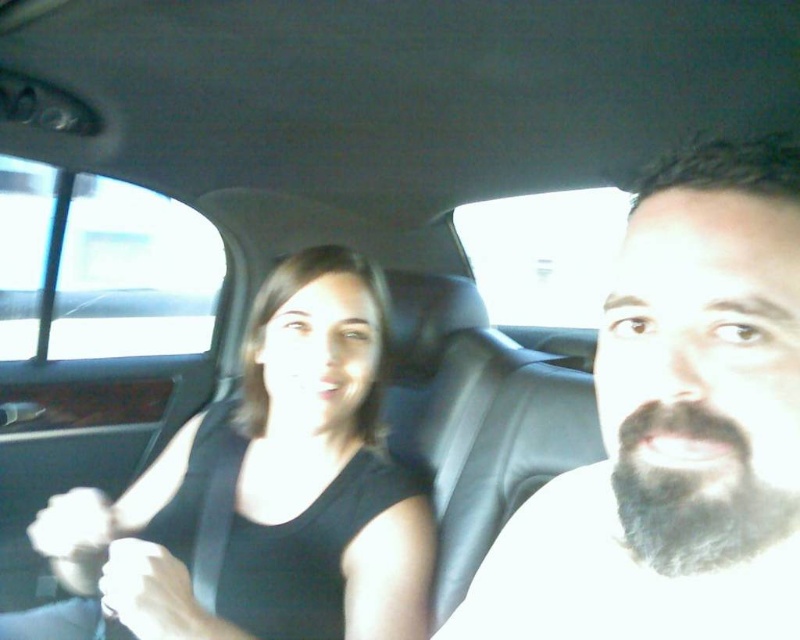
Question: Which point appears closest to the camera in this image?

Choices:
 (A) (324, 499)
 (B) (134, 547)
 (C) (688, 493)

Answer: (C)

Question: Which point is farther to the camera?

Choices:
 (A) white fabric hand at lower left
 (B) matte black hand at center
 (C) black fabric shirt at upper left
 (D) dark brown beard at right

Answer: (A)

Question: From the image, what is the correct spatial relationship of matte black hand at center in relation to white fabric hand at lower left?

Choices:
 (A) above
 (B) below

Answer: (B)

Question: Which of the following is the farthest from the observer?

Choices:
 (A) (356, 541)
 (B) (104, 538)

Answer: (A)

Question: Does dark brown beard at right have a larger size compared to black fabric shirt at upper left?

Choices:
 (A) no
 (B) yes

Answer: (A)

Question: Is black fabric shirt at upper left above white fabric hand at lower left?

Choices:
 (A) no
 (B) yes

Answer: (B)